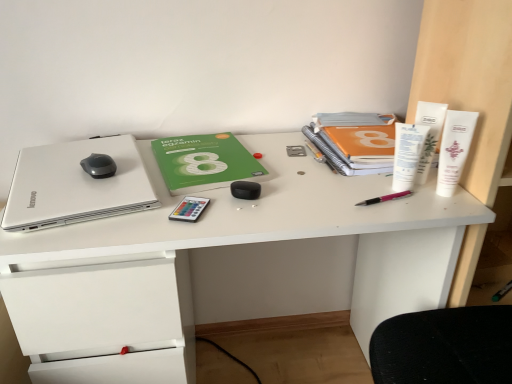
In order to click on unoccupied region to the right of pink metallic pen at center-right, which ranks as the 4th stationery in right-to-left order in this screenshot , I will do tap(437, 197).